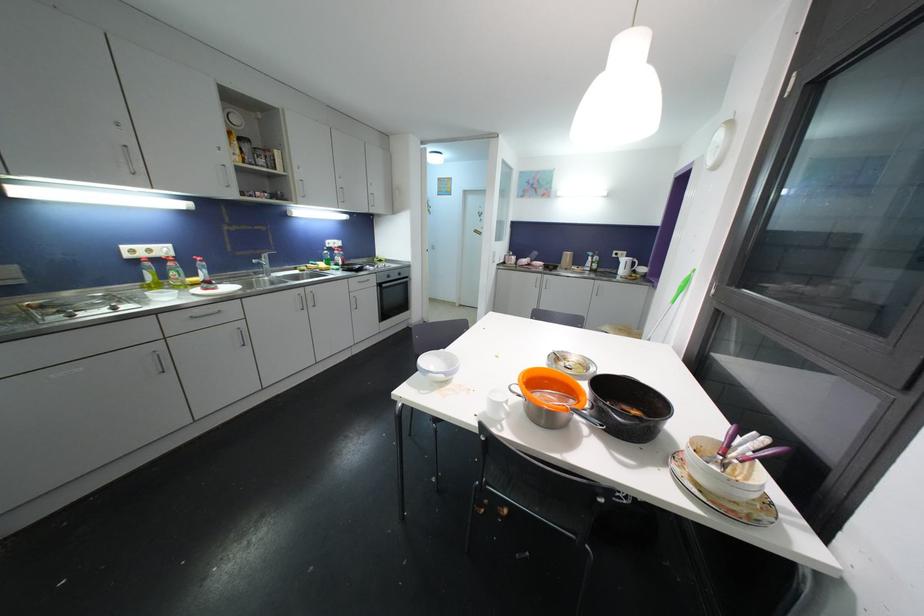
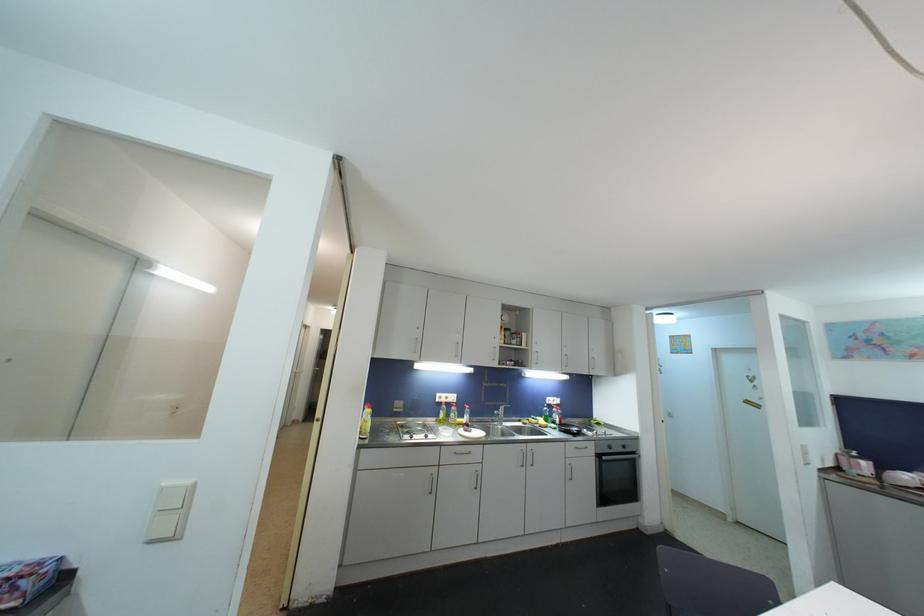
First-person continuous shooting, in which direction is the camera rotating?

The camera rotated toward left-up.